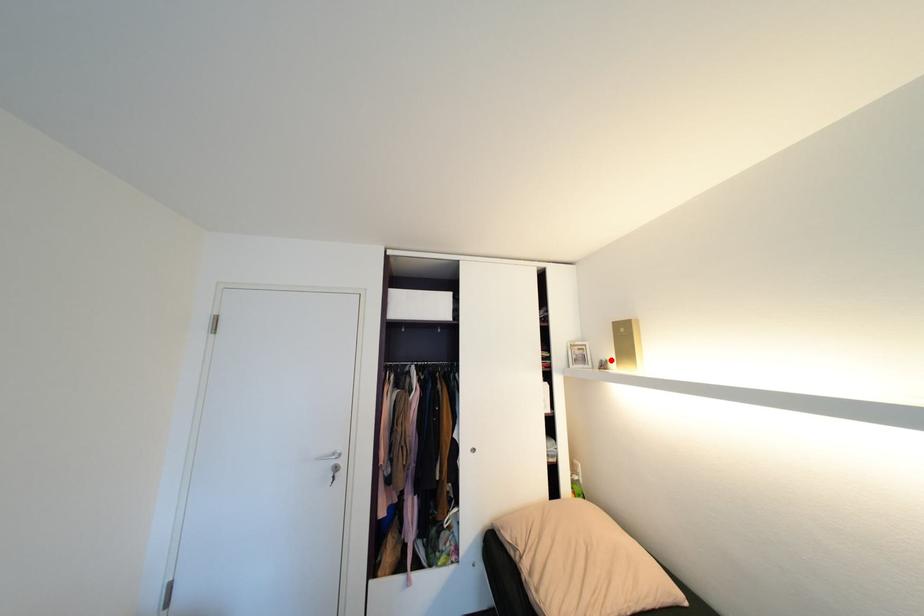
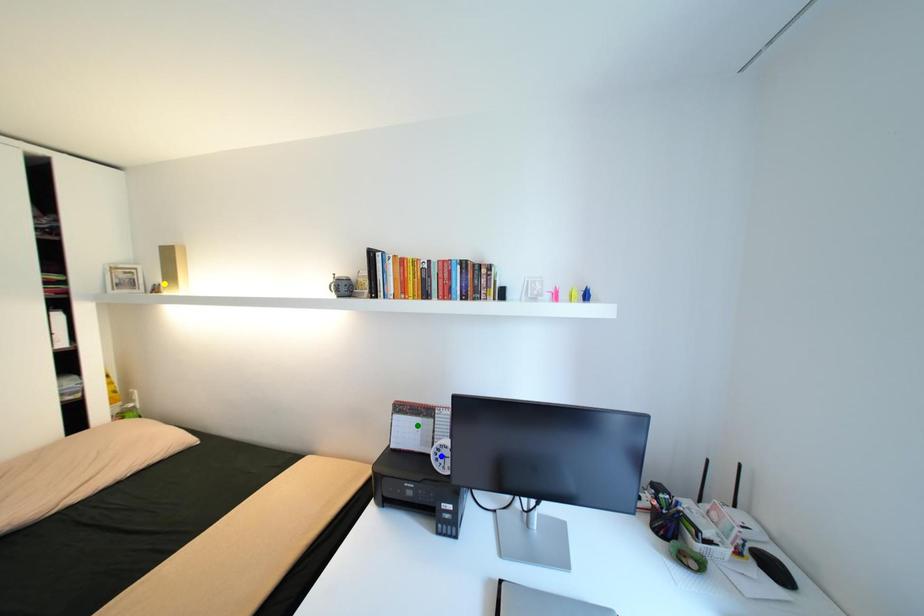
Question: I am providing you with two images of the same scene from different viewpoints. A red point is marked on the first image. You are given multiple points on the second image. Which point in image 2 is actually the same real-world point as the red point in image 1?

Choices:
 (A) blue point
 (B) green point
 (C) yellow point

Answer: (C)